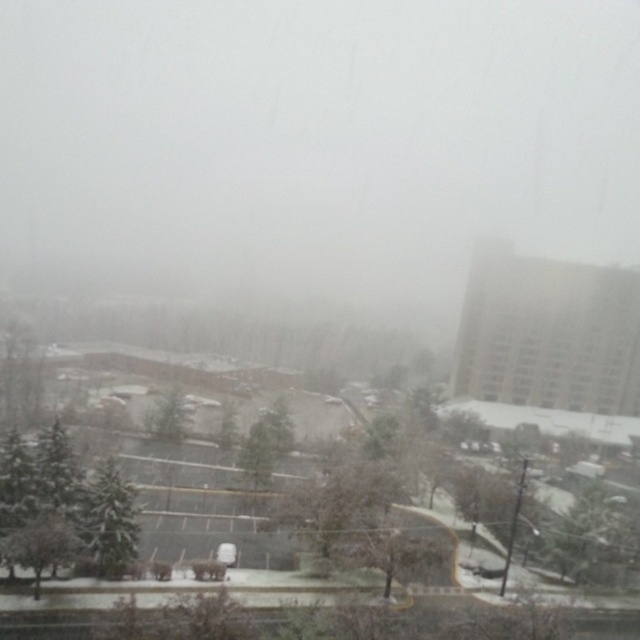
You are standing at the point closest to the camera in the parking lot. There are two points marked in the image, one at coordinates point [100,529] and another at point [157,432]. Which point is closer to your current position?

Point [100,529] is in front of point [157,432], so it is closer to your current position.